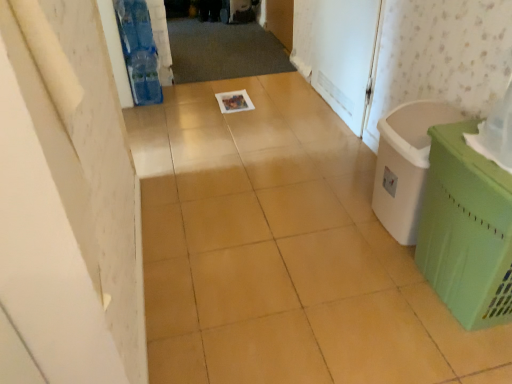
Question: In terms of width, does green plastic basket at right look wider or thinner when compared to green plastic laundry basket at right?

Choices:
 (A) wide
 (B) thin

Answer: (A)

Question: Looking at the image, does green plastic basket at right seem bigger or smaller compared to green plastic laundry basket at right?

Choices:
 (A) big
 (B) small

Answer: (A)

Question: Which is nearer to the white matte screen door at upper right?

Choices:
 (A) green plastic basket at right
 (B) green plastic laundry basket at right

Answer: (B)

Question: Which is nearer to the green plastic basket at right?

Choices:
 (A) white matte screen door at upper right
 (B) green plastic laundry basket at right

Answer: (B)